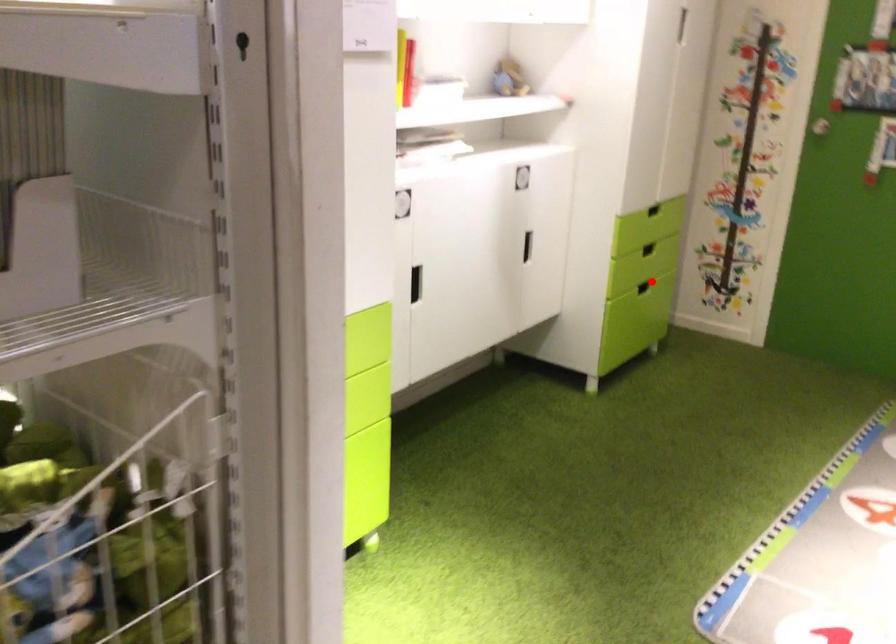
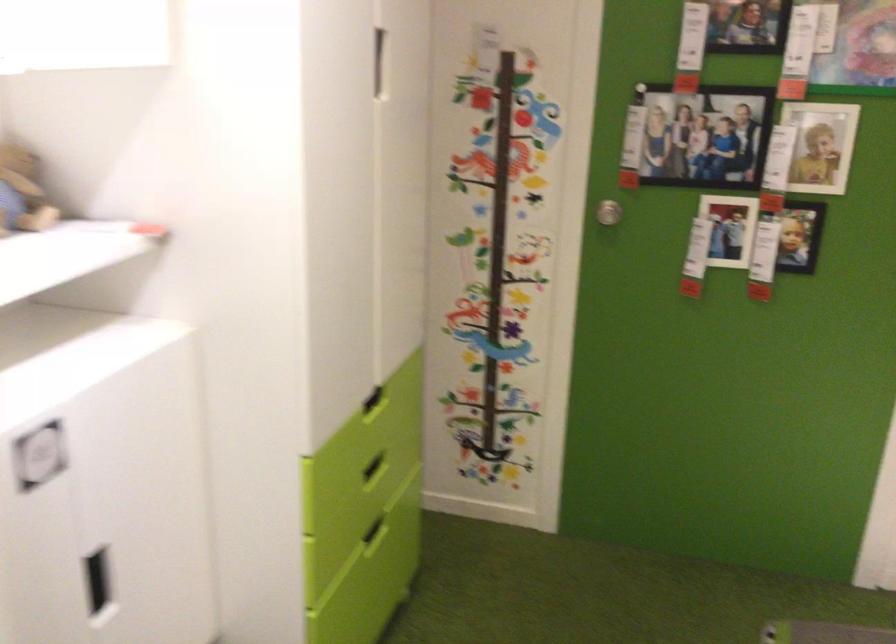
Question: I am providing you with two images of the same scene from different viewpoints. Given a red point in image1, look at the same physical point in image2. Is it:

Choices:
 (A) Closer to the viewpoint
 (B) Farther from the viewpoint

Answer: (A)